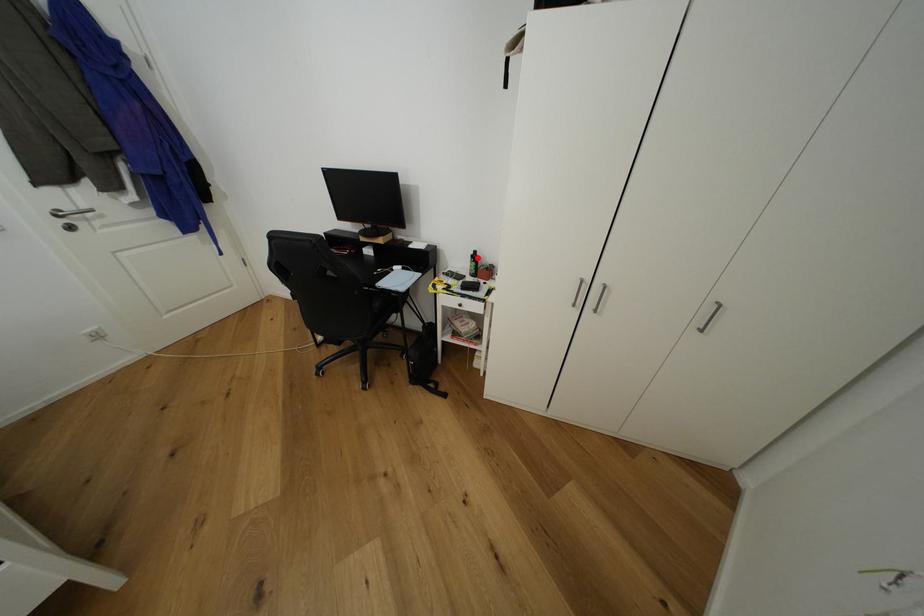
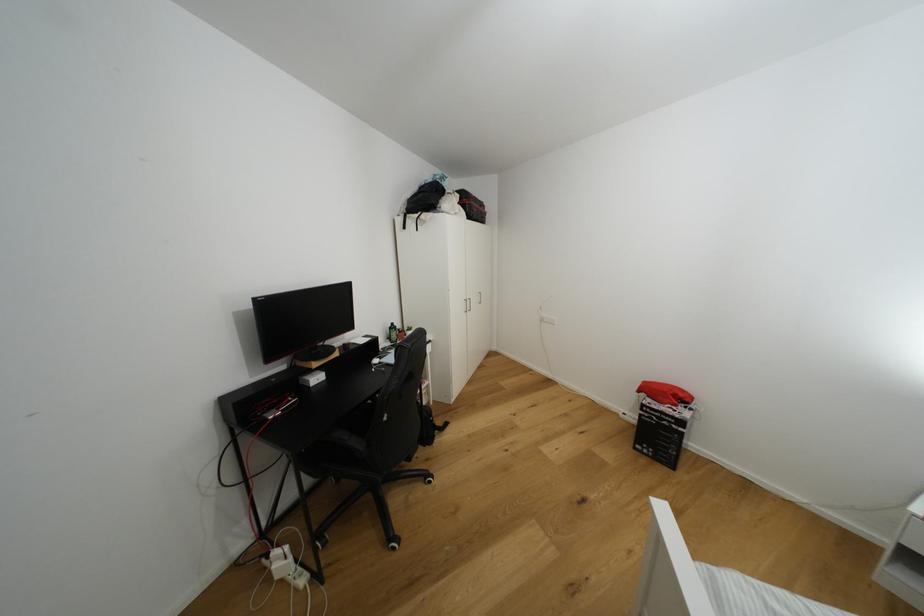
The point at the highlighted location is marked in the first image. Where is the corresponding point in the second image?

(395, 330)